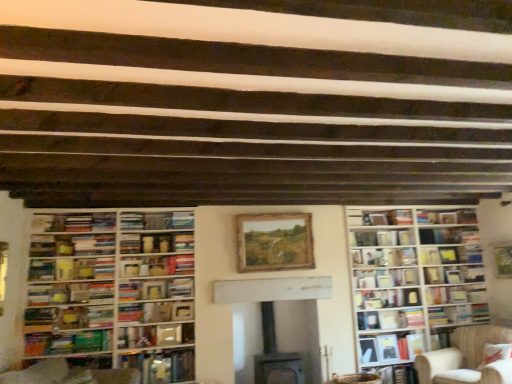
Question: Would you say hardcover books at center, marked as the 5th book in a bottom-to-top arrangement, is inside or outside hardcover book at center, the ninth book positioned from the top?

Choices:
 (A) inside
 (B) outside

Answer: (B)

Question: Is point (433, 306) positioned closer to the camera than point (172, 342)?

Choices:
 (A) farther
 (B) closer

Answer: (A)

Question: Which object is positioned farthest from the hardcover book at center, the ninth book when ordered from bottom to top?

Choices:
 (A) hardcover books at center, marked as the 5th book in a bottom-to-top arrangement
 (B) wooden bookshelf at left, which appears as the second bookcase when viewed from the right
 (C) multicolored paperbacks at lower left, marked as the 7th book in a top-to-bottom arrangement
 (D) hardcover book at left, placed as the 2th book when sorted from top to bottom
 (E) hardcover book at lower right, placed as the first book when sorted from bottom to top

Answer: (D)

Question: Which object is the closest to the hardcover book at center, which is the 7th book in bottom-to-top order?

Choices:
 (A) hardcover book at left, placed as the 2th book when sorted from top to bottom
 (B) multicolored paperbacks at lower left, the 6th book ordered from the bottom
 (C) hardcover book at center, acting as the 10th book starting from the bottom
 (D) hardcover books at center, the 8th book from the top
 (E) wooden bookshelf at left, which appears as the second bookcase when viewed from the right

Answer: (E)